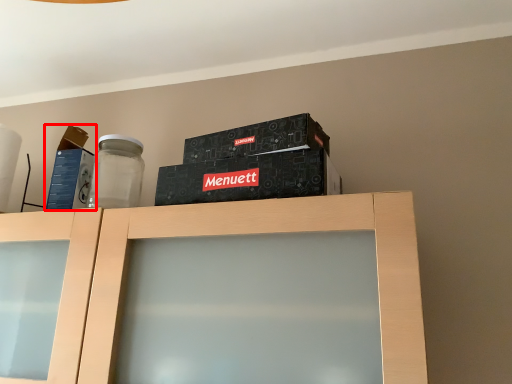
Question: From the image, what is the correct spatial relationship of box (annotated by the red box) in relation to cabinetry?

Choices:
 (A) right
 (B) left

Answer: (B)